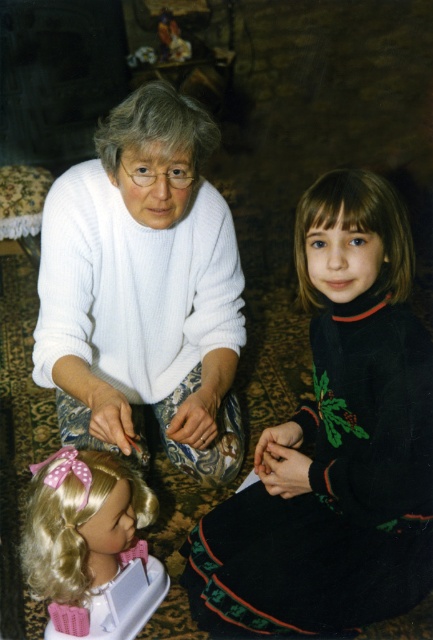
Question: Which is farther from the black matte dress at lower right?

Choices:
 (A) brown smooth hair at center
 (B) blonde hair wig at lower left
 (C) gray matte hair at upper center

Answer: (C)

Question: Does brown smooth hair at center come in front of gray matte hair at upper center?

Choices:
 (A) yes
 (B) no

Answer: (A)

Question: Which object appears farthest from the camera in this image?

Choices:
 (A) blonde hair wig at lower left
 (B) brown smooth hair at center

Answer: (A)

Question: Which of these objects is positioned farthest from the brown smooth hair at center?

Choices:
 (A) white knitted sweater at center
 (B) blonde hair wig at lower left

Answer: (B)

Question: From the image, what is the correct spatial relationship of blonde hair wig at lower left in relation to brown smooth hair at center?

Choices:
 (A) right
 (B) left

Answer: (B)

Question: Does blonde hair wig at lower left have a lesser width compared to brown smooth hair at center?

Choices:
 (A) no
 (B) yes

Answer: (A)